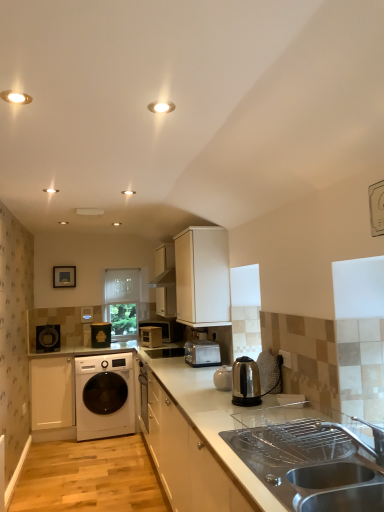
Question: Does white glossy washing machine at lower left touch white glossy light fixture at upper left, the 1th lighting when ordered from front to back?

Choices:
 (A) no
 (B) yes

Answer: (A)

Question: From a real-world perspective, is white glossy washing machine at lower left physically above white glossy light fixture at upper left, which appears as the second lighting when viewed from the back?

Choices:
 (A) yes
 (B) no

Answer: (B)

Question: From a real-world perspective, is white glossy washing machine at lower left under white glossy light fixture at upper left, the 1th lighting when ordered from front to back?

Choices:
 (A) no
 (B) yes

Answer: (B)

Question: Considering the relative sizes of white glossy washing machine at lower left and white glossy light fixture at upper left, the second lighting when ordered from right to left, in the image provided, is white glossy washing machine at lower left wider than white glossy light fixture at upper left, the second lighting when ordered from right to left,?

Choices:
 (A) no
 (B) yes

Answer: (B)

Question: Is white glossy washing machine at lower left bigger than white glossy light fixture at upper left, which appears as the second lighting when viewed from the back?

Choices:
 (A) yes
 (B) no

Answer: (A)

Question: Visually, is matte black speaker at left, which is the first home appliance in back-to-front order, positioned to the left or to the right of stainless steel sink at lower right?

Choices:
 (A) left
 (B) right

Answer: (A)

Question: From a real-world perspective, is matte black speaker at left, which is the first home appliance in back-to-front order, above or below stainless steel sink at lower right?

Choices:
 (A) below
 (B) above

Answer: (B)

Question: Considering their positions, is matte black speaker at left, positioned as the 3th home appliance in front-to-back order, located in front of or behind stainless steel sink at lower right?

Choices:
 (A) front
 (B) behind

Answer: (B)

Question: From the image's perspective, is matte black speaker at left, the first home appliance from the left, positioned above or below stainless steel sink at lower right?

Choices:
 (A) above
 (B) below

Answer: (B)

Question: Is metallic silver microwave at center, placed as the second appliance when sorted from left to right, to the left or to the right of metallic silver toaster at center, the 2th appliance positioned from the right, in the image?

Choices:
 (A) left
 (B) right

Answer: (B)

Question: Is metallic silver microwave at center, placed as the second appliance when sorted from left to right, inside the boundaries of metallic silver toaster at center, marked as the 1th appliance in a left-to-right arrangement, or outside?

Choices:
 (A) outside
 (B) inside

Answer: (A)

Question: Considering their positions, is metallic silver microwave at center, positioned as the first appliance in right-to-left order, located in front of or behind metallic silver toaster at center, the 2th appliance positioned from the right?

Choices:
 (A) behind
 (B) front

Answer: (B)

Question: Looking at their shapes, would you say metallic silver microwave at center, placed as the second appliance when sorted from left to right, is wider or thinner than metallic silver toaster at center, marked as the 1th appliance in a left-to-right arrangement?

Choices:
 (A) wide
 (B) thin

Answer: (B)

Question: Is stainless steel kettle at center, marked as the first home appliance in a right-to-left arrangement, to the left or to the right of metallic silver microwave at center, positioned as the first appliance in right-to-left order, in the image?

Choices:
 (A) right
 (B) left

Answer: (A)

Question: Relative to metallic silver microwave at center, positioned as the first appliance in right-to-left order, is stainless steel kettle at center, placed as the 3th home appliance when sorted from left to right, in front or behind?

Choices:
 (A) behind
 (B) front

Answer: (B)